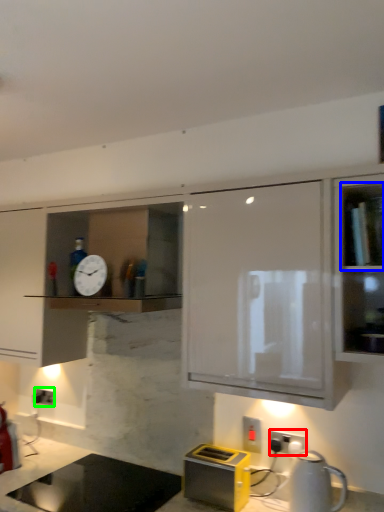
Question: Estimate the real-world distances between objects in this image. Which object is farther from electric outlet (highlighted by a red box), shelf (highlighted by a blue box) or electric outlet (highlighted by a green box)?

Choices:
 (A) shelf
 (B) electric outlet

Answer: (B)